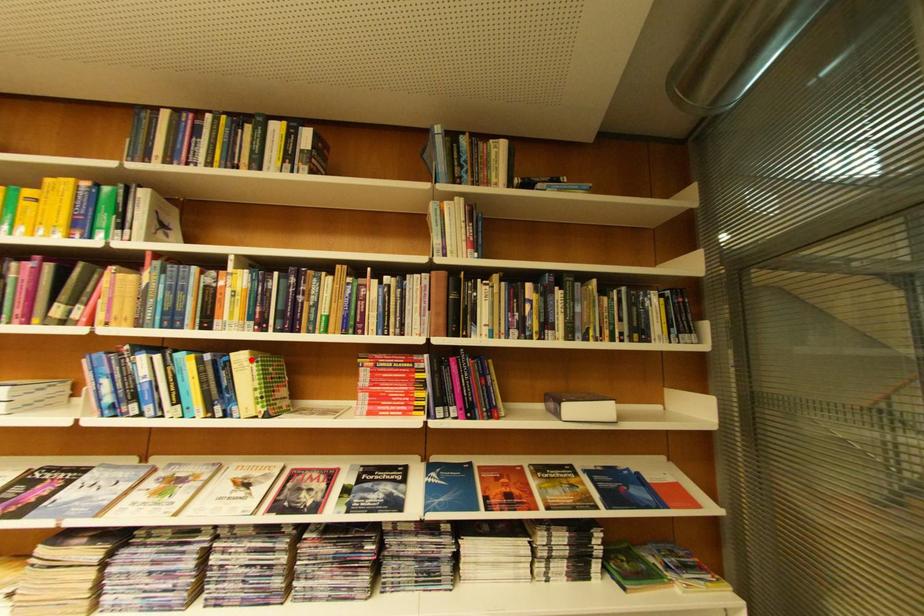
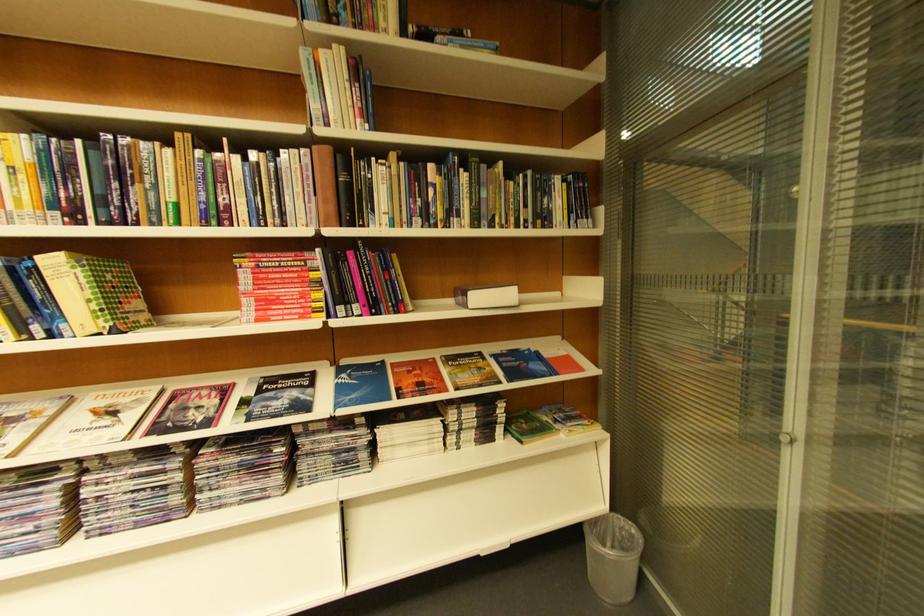
Find the pixel in the second image that matches the highlighted location in the first image.

(63, 264)